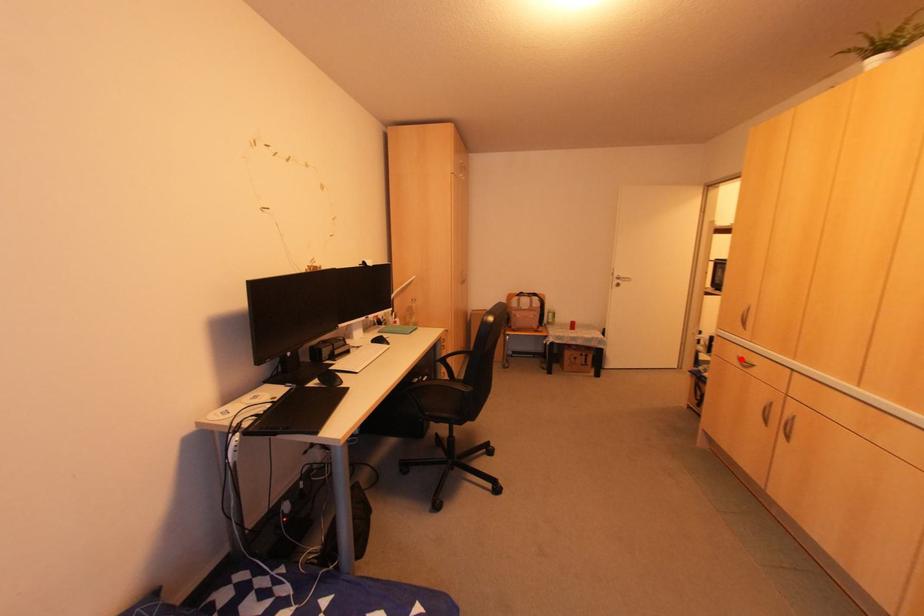
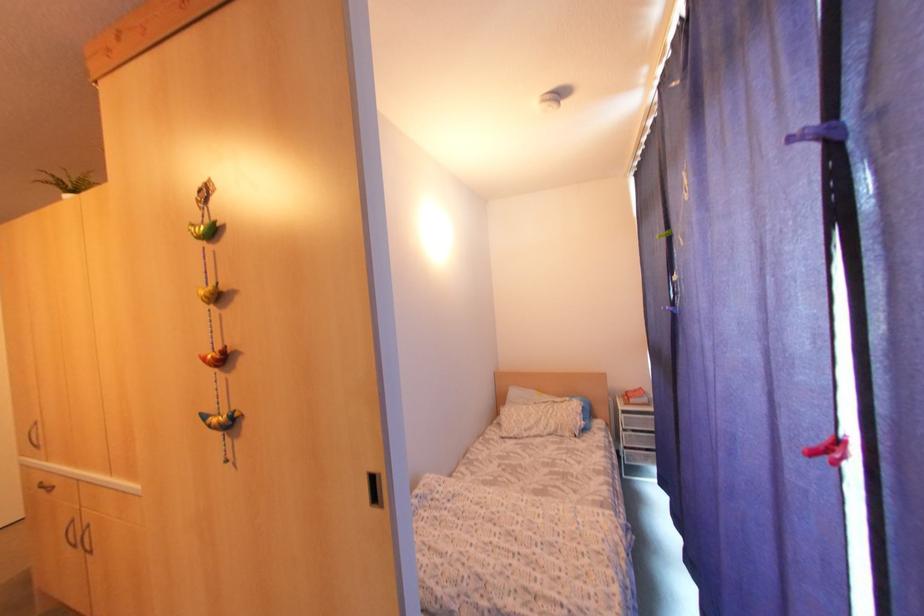
Question: I am providing you with two images of the same scene from different viewpoints. Image1 has a red point marked. In image2, the corresponding 3D location appears at what relative position? Reply with the corresponding letter.

Choices:
 (A) Closer
 (B) Farther

Answer: (A)